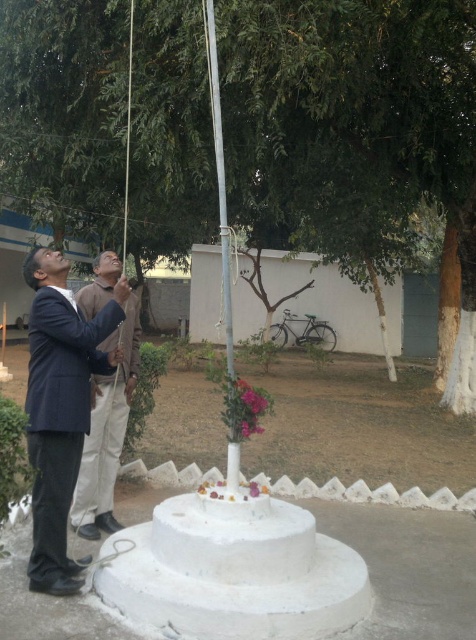
Question: Is green leafy tree at center below dark blue fabric business suit at left?

Choices:
 (A) yes
 (B) no

Answer: (B)

Question: Estimate the real-world distances between objects in this image. Which object is closer to the green leafy tree at center?

Choices:
 (A) white matte wedding cake at center
 (B) dark blue suit at left
 (C) silver metallic pole at center
 (D) dark blue fabric business suit at left

Answer: (C)

Question: Which object is farther from the camera taking this photo?

Choices:
 (A) silver metallic pole at center
 (B) green leafy tree at center
 (C) dark blue fabric business suit at left

Answer: (B)

Question: Is green leafy tree at center positioned in front of silver metallic pole at center?

Choices:
 (A) no
 (B) yes

Answer: (A)

Question: Which is farther from the dark blue fabric business suit at left?

Choices:
 (A) dark blue suit at left
 (B) white matte wedding cake at center
 (C) green leafy tree at center

Answer: (C)

Question: From the image, what is the correct spatial relationship of dark blue fabric business suit at left in relation to silver metallic pole at center?

Choices:
 (A) right
 (B) left

Answer: (B)